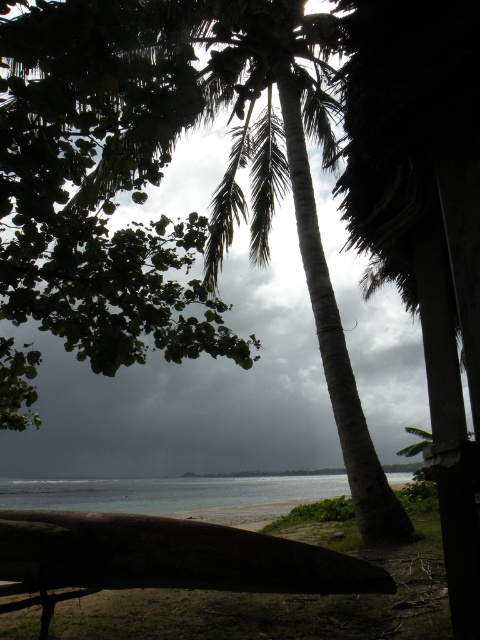
You are standing on the beach and want to take a photo of the green textured palm tree at center and the clear water at lower center. If you want the palm tree to appear closer to the camera than the water in the photo, is your current position suitable?

Yes, because the green textured palm tree at center is in front of clear water at lower center, so from your current position on the beach, the palm tree will naturally appear closer to the camera than the water in the photo.

You are a photographer trying to capture the green textured palm tree at center and the clear water at lower center in a single frame. Based on their sizes, which object will occupy more space in your photo?

The green textured palm tree at center will occupy more space in the photo because it has a larger size compared to the clear water at lower center.

You are standing on the beach and want to take a photo of the green textured palm tree at center and the clear water at lower center. If you want to ensure both are visible in the same frame, where should you position yourself relative to the palm tree?

You should position yourself to the right of the green textured palm tree at center so that it is leaning towards the clear water at lower center, allowing both to be captured in the same frame.